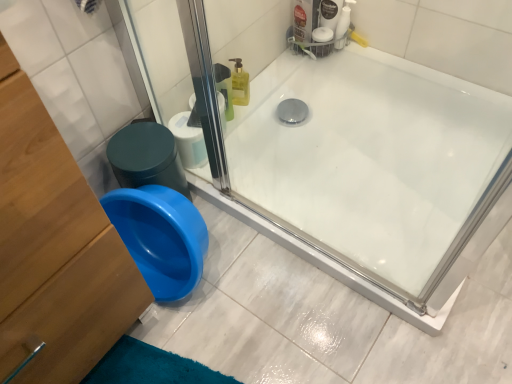
Measure the distance between point (283, 96) and camera.

The depth of point (283, 96) is 1.39 meters.

In order to face white matte toilet paper at center, should I rotate leftwards or rightwards?

You should look left and rotate roughly 9.435 degrees.

This screenshot has width=512, height=384. Identify the location of white glossy bathtub at center. (374, 174).

Can you confirm if white glossy bathtub at center is thinner than white matte toilet paper at center?

No.

In the image, is white glossy bathtub at center positioned in front of or behind white matte toilet paper at center?

In the image, white glossy bathtub at center appears in front of white matte toilet paper at center.

Locate an element on the screen. The image size is (512, 384). toilet paper above the white glossy bathtub at center (from a real-world perspective) is located at coordinates (188, 141).

Who is smaller, white glossy bathtub at center or white matte toilet paper at center?

Smaller between the two is white matte toilet paper at center.

From the image's perspective, is wooden dresser at lower left beneath white glossy bathtub at center?

Yes, from the image's perspective, wooden dresser at lower left is below white glossy bathtub at center.

Does wooden dresser at lower left turn towards white glossy bathtub at center?

No, wooden dresser at lower left is not aimed at white glossy bathtub at center.

Is white glossy bathtub at center completely or partially inside wooden dresser at lower left?

That's incorrect, white glossy bathtub at center is not inside wooden dresser at lower left.

Who is shorter, wooden dresser at lower left or white glossy bathtub at center?

With less height is white glossy bathtub at center.

Is white matte toilet paper at center far away from wooden dresser at lower left?

Actually, white matte toilet paper at center and wooden dresser at lower left are a little close together.

Between white matte toilet paper at center and wooden dresser at lower left, which one has smaller size?

With smaller size is white matte toilet paper at center.

Is white matte toilet paper at center in front of wooden dresser at lower left?

No, it is behind wooden dresser at lower left.

Which is in front, point (196, 158) or point (49, 268)?

The point (49, 268) is in front.

Consider the image. Is white glossy bathtub at center in front of or behind wooden dresser at lower left in the image?

white glossy bathtub at center is behind wooden dresser at lower left.

Measure the distance from white glossy bathtub at center to wooden dresser at lower left.

white glossy bathtub at center is 67.95 centimeters from wooden dresser at lower left.

From a real-world perspective, is white glossy bathtub at center below wooden dresser at lower left?

Yes, from a real-world perspective, white glossy bathtub at center is under wooden dresser at lower left.

Is white glossy bathtub at center turned away from wooden dresser at lower left?

No.

From a real-world perspective, does white matte toilet paper at center sit lower than white glossy bathtub at center?

No.

Consider the image. Does white matte toilet paper at center have a lesser width compared to white glossy bathtub at center?

Yes, white matte toilet paper at center is thinner than white glossy bathtub at center.

In the scene shown: Considering the relative positions of white matte toilet paper at center and white glossy bathtub at center in the image provided, is white matte toilet paper at center to the right of white glossy bathtub at center from the viewer's perspective?

Incorrect, white matte toilet paper at center is not on the right side of white glossy bathtub at center.

From the image's perspective, is wooden dresser at lower left above white matte toilet paper at center?

No.

From a real-world perspective, relative to white matte toilet paper at center, is wooden dresser at lower left vertically above or below?

wooden dresser at lower left is situated higher than white matte toilet paper at center in the real world.

Can you tell me how much wooden dresser at lower left and white matte toilet paper at center differ in facing direction?

0.778 degrees.

Is point (100, 315) farther from camera compared to point (182, 123)?

No, (100, 315) is closer to viewer.

What are the coordinates of `toilet paper lying behind the white glossy bathtub at center` in the screenshot? It's located at (188, 141).

The height and width of the screenshot is (384, 512). I want to click on dresser below the white glossy bathtub at center (from the image's perspective), so click(54, 249).

When comparing their distances from wooden dresser at lower left, does white glossy bathtub at center or white matte toilet paper at center seem further?

Among the two, white glossy bathtub at center is located further to wooden dresser at lower left.

Looking at the image, which one is located closer to white glossy bathtub at center, wooden dresser at lower left or white matte toilet paper at center?

white matte toilet paper at center is positioned closer to the anchor white glossy bathtub at center.

Which object lies further to the anchor point white matte toilet paper at center, white glossy bathtub at center or wooden dresser at lower left?

The object further to white matte toilet paper at center is wooden dresser at lower left.

Considering their positions, is white matte toilet paper at center positioned further to wooden dresser at lower left than white glossy bathtub at center?

The object further to wooden dresser at lower left is white glossy bathtub at center.

Consider the image. Based on their spatial positions, is wooden dresser at lower left or white glossy bathtub at center further from white matte toilet paper at center?

wooden dresser at lower left is positioned further to the anchor white matte toilet paper at center.

When comparing their distances from white glossy bathtub at center, does white matte toilet paper at center or wooden dresser at lower left seem closer?

white matte toilet paper at center is closer to white glossy bathtub at center.

At what (x,y) coordinates should I click in order to perform the action: click on bathtub located between wooden dresser at lower left and white matte toilet paper at center in the depth direction. Please return your answer as a coordinate pair (x, y). The image size is (512, 384). Looking at the image, I should click on (x=374, y=174).